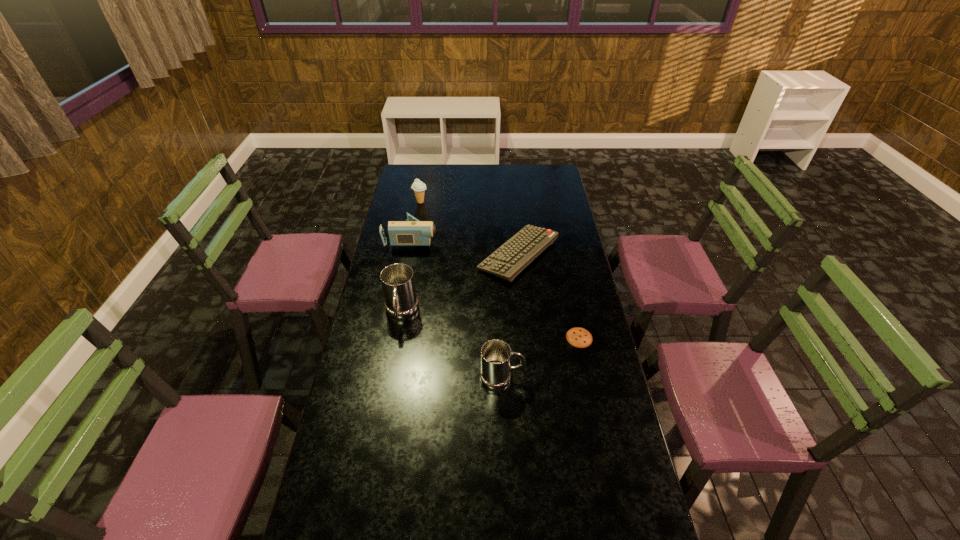
Identify the location of the left mug. (401, 302).

Where is `the tallest object`? This screenshot has width=960, height=540. the tallest object is located at coordinates (401, 302).

Locate an element on the screen. This screenshot has height=540, width=960. the right mug is located at coordinates (496, 355).

Locate an element on the screen. The height and width of the screenshot is (540, 960). the nearest object is located at coordinates (496, 355).

Image resolution: width=960 pixels, height=540 pixels. I want to click on the second shortest object, so click(x=506, y=262).

What are the coordinates of `icecream` in the screenshot? It's located at (419, 187).

Image resolution: width=960 pixels, height=540 pixels. Find the location of `camcorder`. camcorder is located at coordinates (412, 232).

Identify the location of cookie. The image size is (960, 540). (579, 337).

This screenshot has width=960, height=540. In order to click on free spot located 0.160m on the side of the taller mug with the handle in this screenshot , I will do coord(392,367).

Locate an element on the screen. Image resolution: width=960 pixels, height=540 pixels. vacant space located on the side of the right mug with the handle is located at coordinates (562, 377).